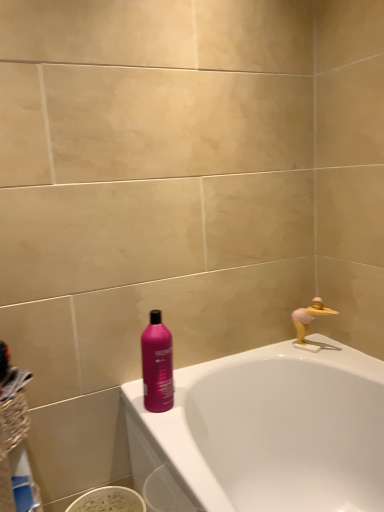
Question: Does white glossy bathtub at upper right have a larger size compared to blue plastic bottle at lower left?

Choices:
 (A) yes
 (B) no

Answer: (A)

Question: Does white glossy bathtub at upper right lie in front of blue plastic bottle at lower left?

Choices:
 (A) yes
 (B) no

Answer: (A)

Question: Is white glossy bathtub at upper right turned away from blue plastic bottle at lower left?

Choices:
 (A) yes
 (B) no

Answer: (B)

Question: Can you confirm if white glossy bathtub at upper right is smaller than blue plastic bottle at lower left?

Choices:
 (A) yes
 (B) no

Answer: (B)

Question: Considering the relative positions of white glossy bathtub at upper right and blue plastic bottle at lower left in the image provided, is white glossy bathtub at upper right to the right of blue plastic bottle at lower left from the viewer's perspective?

Choices:
 (A) no
 (B) yes

Answer: (B)

Question: Can you confirm if white glossy bathtub at upper right is wider than blue plastic bottle at lower left?

Choices:
 (A) yes
 (B) no

Answer: (A)

Question: Is yellow rubber duck at upper right at the left side of white glossy bathtub at upper right?

Choices:
 (A) yes
 (B) no

Answer: (B)

Question: Is yellow rubber duck at upper right shorter than white glossy bathtub at upper right?

Choices:
 (A) yes
 (B) no

Answer: (A)

Question: Considering the relative sizes of yellow rubber duck at upper right and white glossy bathtub at upper right in the image provided, is yellow rubber duck at upper right wider than white glossy bathtub at upper right?

Choices:
 (A) yes
 (B) no

Answer: (B)

Question: Is yellow rubber duck at upper right behind white glossy bathtub at upper right?

Choices:
 (A) no
 (B) yes

Answer: (B)

Question: From the image's perspective, is yellow rubber duck at upper right below white glossy bathtub at upper right?

Choices:
 (A) no
 (B) yes

Answer: (A)

Question: Does yellow rubber duck at upper right lie in front of white glossy bathtub at upper right?

Choices:
 (A) yes
 (B) no

Answer: (B)

Question: Can you confirm if matte pink bottle at center is thinner than yellow rubber duck at upper right?

Choices:
 (A) no
 (B) yes

Answer: (A)